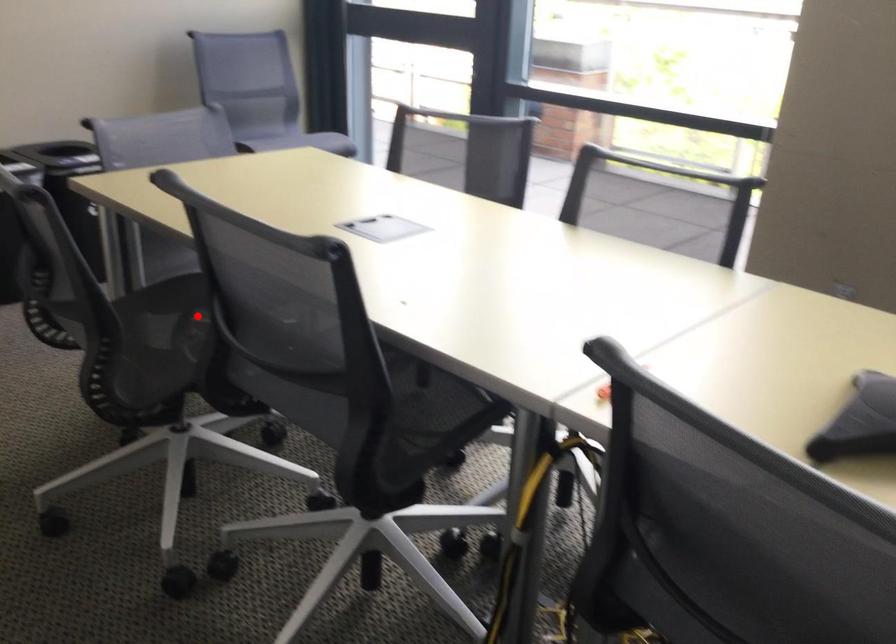
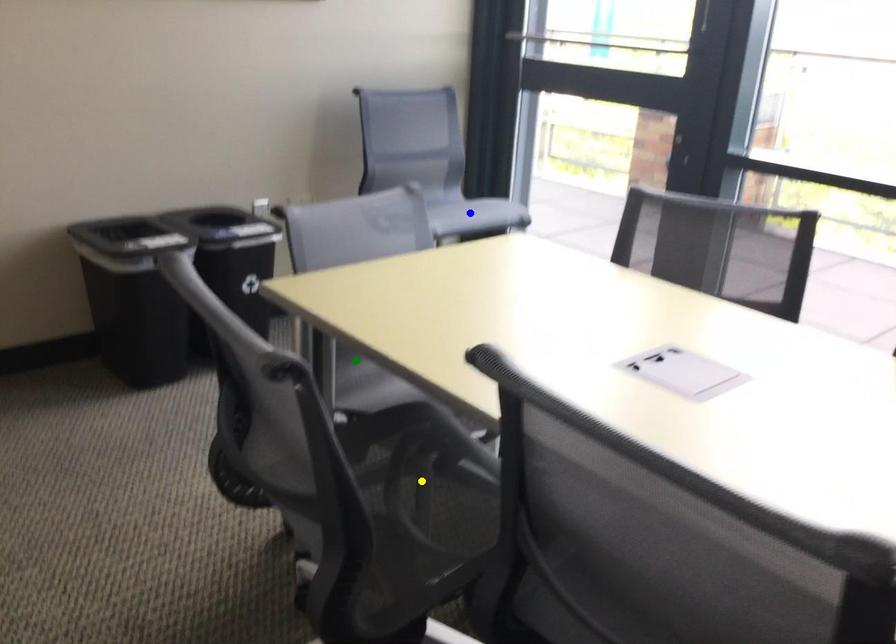
Question: I am providing you with two images of the same scene from different viewpoints. A red point is marked on the first image. You are given multiple points on the second image. In image 2, which mark is for the same physical point as the one in image 1?

Choices:
 (A) yellow point
 (B) green point
 (C) blue point

Answer: (A)